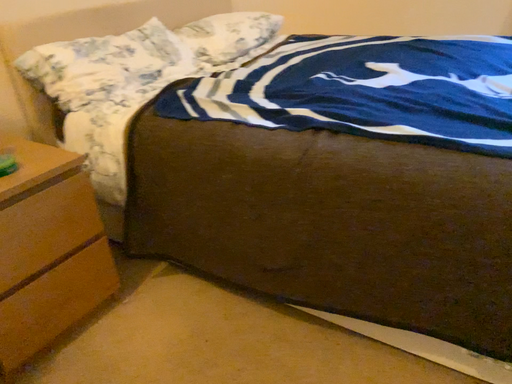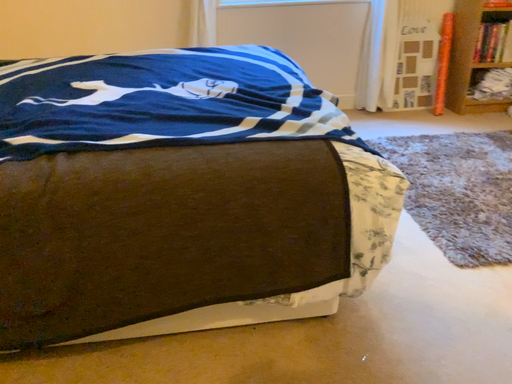
Question: Which way did the camera rotate in the video?

Choices:
 (A) rotated left
 (B) rotated right

Answer: (B)